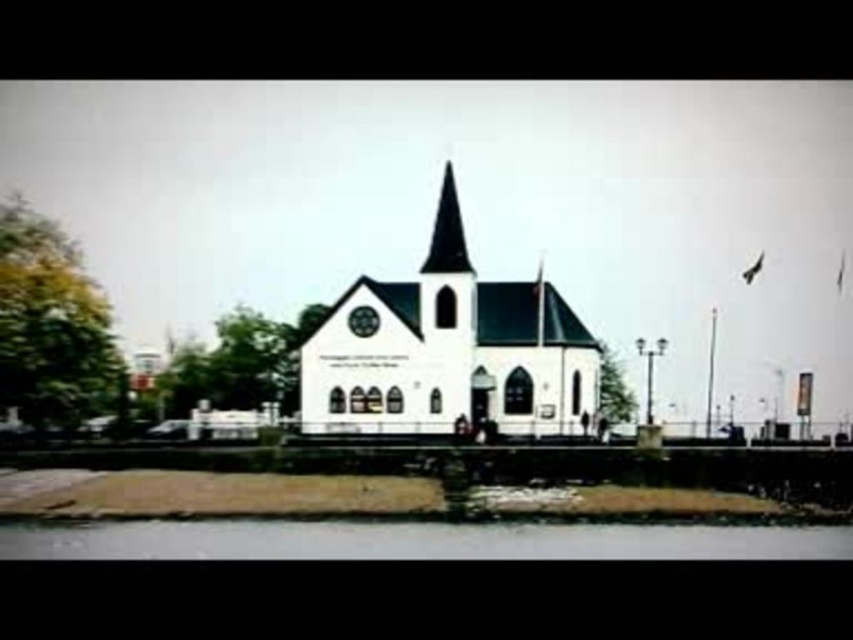
Between point (508, 323) and point (715, 540), which one is positioned behind?

The point (508, 323) is more distant.

I want to click on white matte church at center, so click(448, 349).

Can you confirm if white matte church at center is taller than black glass spire at center?

Correct, white matte church at center is much taller as black glass spire at center.

Find the location of a particular element. The image size is (853, 640). white matte church at center is located at coordinates (448, 349).

Can you confirm if clear water at lower center is positioned to the left of black glass spire at center?

Indeed, clear water at lower center is positioned on the left side of black glass spire at center.

Based on the photo, between clear water at lower center and black glass spire at center, which one is positioned higher?

black glass spire at center is higher up.

Between point (473, 540) and point (437, 244), which one is positioned behind?

The point (437, 244) is behind.

You are a GUI agent. You are given a task and a screenshot of the screen. Output one action in this format:
    pyautogui.click(x=<x>, y=<y>)
    Task: Click on the clear water at lower center
    This screenshot has width=853, height=640.
    Given the screenshot: What is the action you would take?
    pyautogui.click(x=416, y=540)